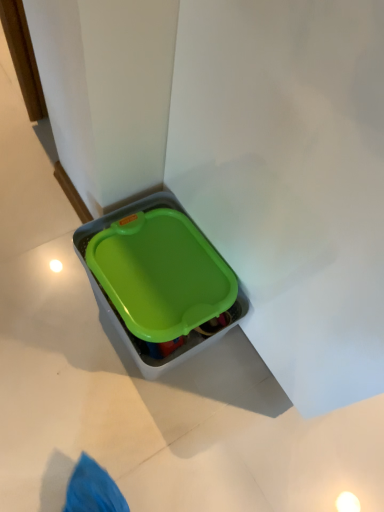
Locate an element on the screen. The image size is (384, 512). free space to the left of green plastic container at lower left is located at coordinates 44,281.